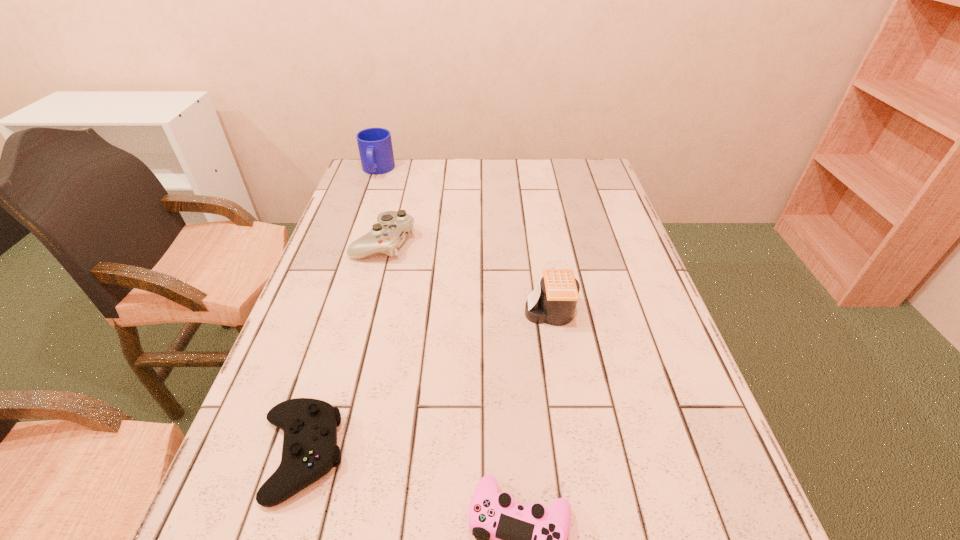
Find the location of a particular element. Image resolution: width=960 pixels, height=540 pixels. mug is located at coordinates (375, 147).

Find the location of `the tallest object`. the tallest object is located at coordinates (375, 147).

Locate an element on the screen. The width and height of the screenshot is (960, 540). the fourth shortest object is located at coordinates (553, 301).

Where is `calculator`? This screenshot has height=540, width=960. calculator is located at coordinates (553, 301).

In order to click on the second farthest object in this screenshot , I will do `click(387, 235)`.

Find the location of a particular element. the tallest control is located at coordinates (387, 235).

Identify the location of vacant point located on the side with the handle of the tallest object. (355, 233).

This screenshot has height=540, width=960. Identify the location of free region located 0.280m on the back of the fourth shortest object. (536, 229).

This screenshot has height=540, width=960. Find the location of `vacant space situated 0.210m on the back of the farthest control`. vacant space situated 0.210m on the back of the farthest control is located at coordinates (399, 185).

This screenshot has width=960, height=540. Find the location of `object present at the far edge`. object present at the far edge is located at coordinates (375, 147).